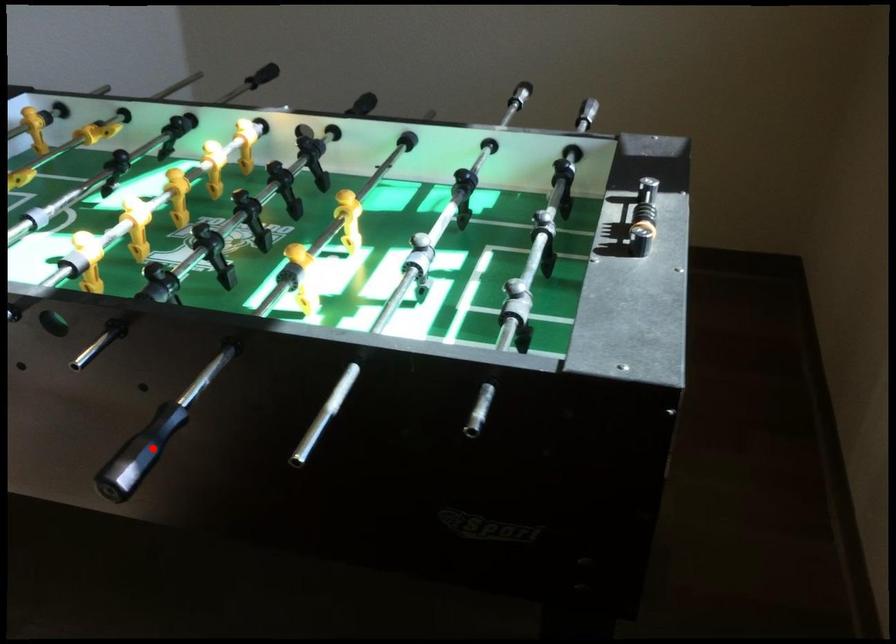
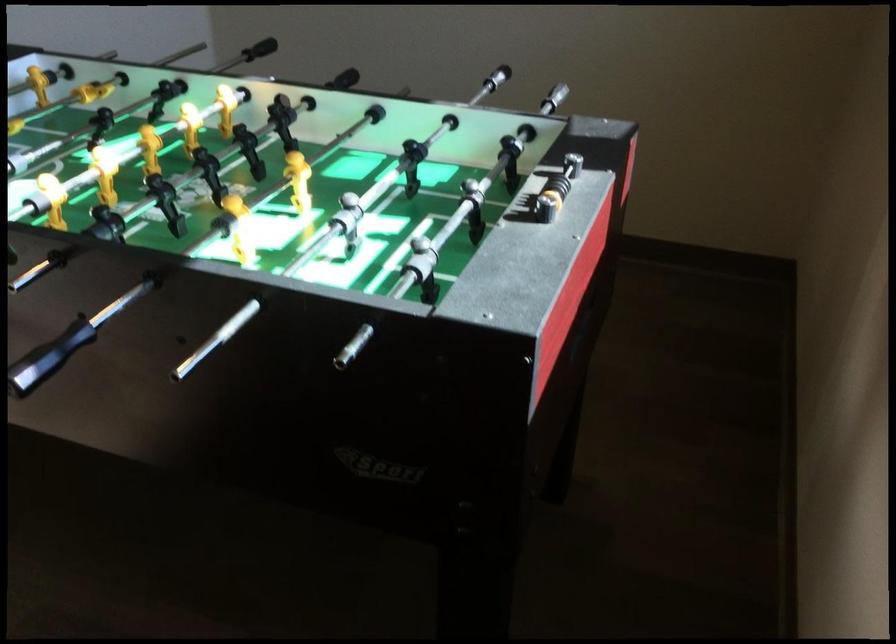
Question: I am providing you with two images of the same scene from different viewpoints. A red point is shown in image1. For the corresponding object point in image2, is it positioned nearer or farther from the camera?

Choices:
 (A) Nearer
 (B) Farther

Answer: (B)